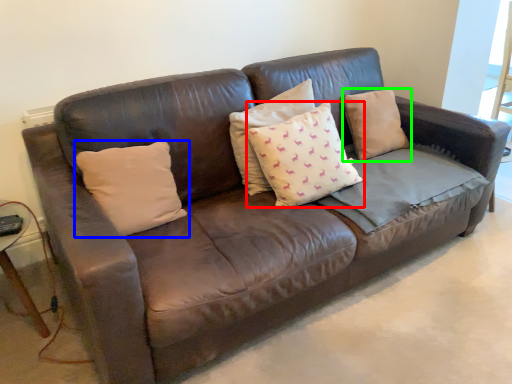
Question: Based on their relative distances, which object is nearer to pillow (highlighted by a red box)? Choose from pillow (highlighted by a blue box) and pillow (highlighted by a green box).

Choices:
 (A) pillow
 (B) pillow

Answer: (B)